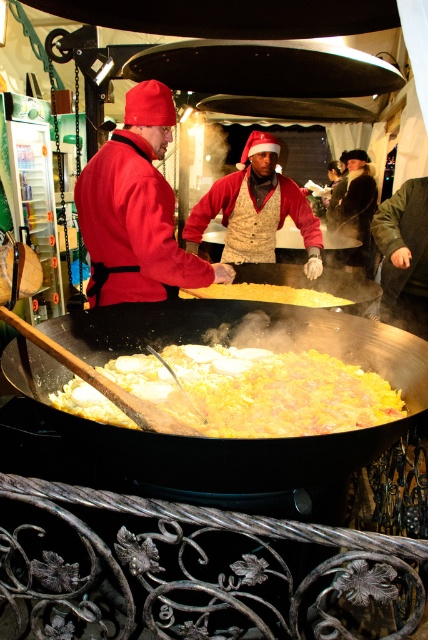
You are a chef preparing a dish and need to choose between the black matte wok at center and the yellow matte wok at center. Which wok has a larger width?

The black matte wok at center has a larger width than the yellow matte wok at center according to the description.

You are a chef at a busy outdoor event. You need to choose between the black matte wok at center and the yellow matte wok at center to prepare a large batch of food. Which wok should you select and why?

You should select the black matte wok at center because it has a larger size compared to the yellow matte wok at center, making it more suitable for preparing a large batch of food.

You are a chef preparing a dish and need to move the yellow matte food at center to the yellow matte wok at center. Given that your serving spoon can reach 25 centimeters, can you reach the food without moving closer?

The yellow matte food at center and yellow matte wok at center are 27.21 centimeters apart, so the serving spoon cannot reach since it only extends 25 centimeters. You need to move closer.